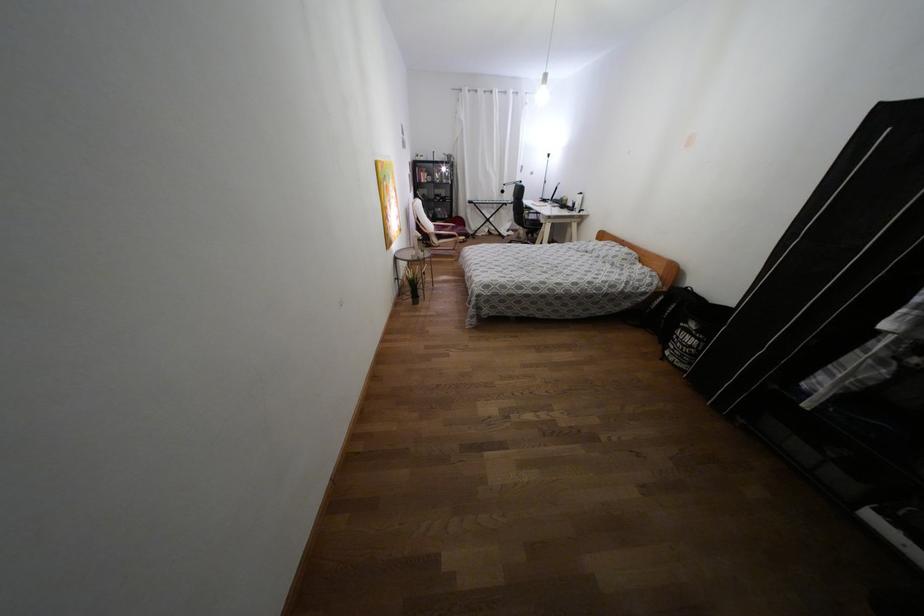
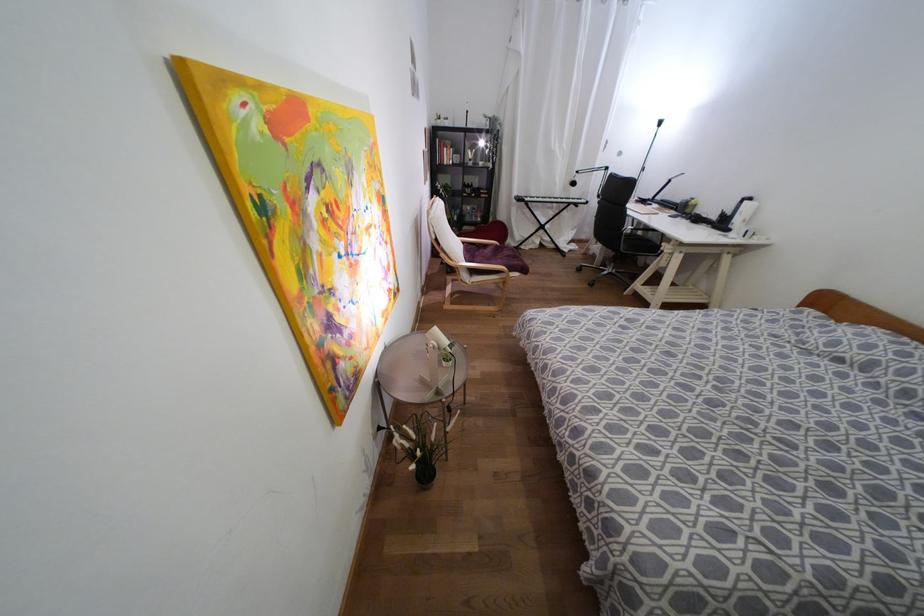
Locate, in the second image, the point that corresponds to pixel 444 169 in the first image.

(480, 143)